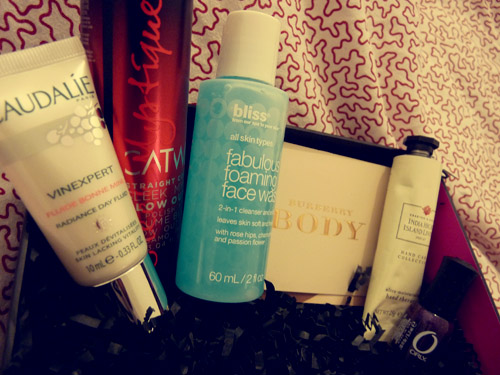
I want to click on curtain, so click(43, 9), click(368, 76).